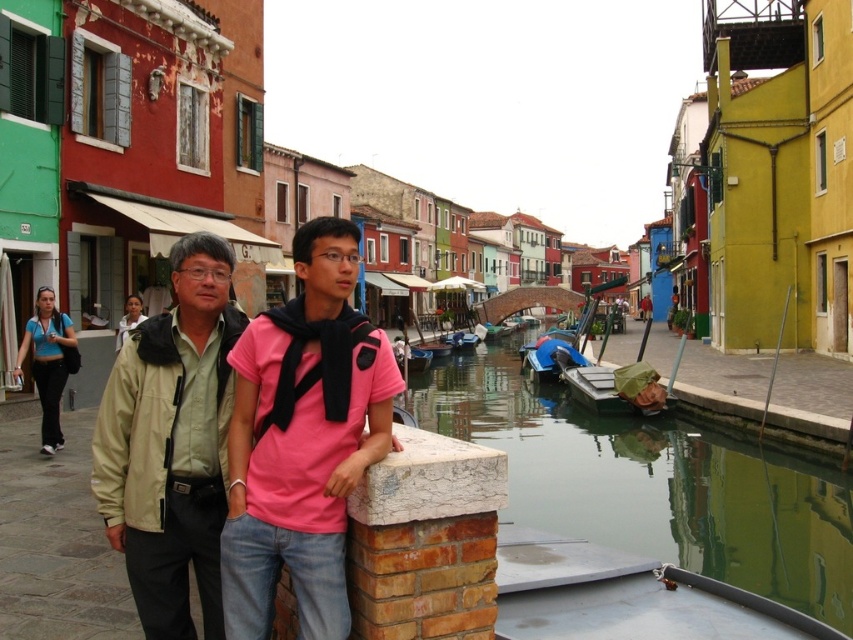
Can you confirm if metallic silver boat at lower right is smaller than blue athletic wear at left?

Yes, metallic silver boat at lower right is smaller than blue athletic wear at left.

Between metallic silver boat at lower right and blue athletic wear at left, which one has more height?

blue athletic wear at left

Is point (547, 556) closer to viewer compared to point (41, 380)?

Yes, it is in front of point (41, 380).

I want to click on metallic silver boat at lower right, so click(625, 596).

Can you confirm if green reflective water at lower center is positioned above beige fabric jacket at center?

Actually, green reflective water at lower center is below beige fabric jacket at center.

Does green reflective water at lower center appear on the right side of beige fabric jacket at center?

Yes, green reflective water at lower center is to the right of beige fabric jacket at center.

Who is more forward, (741,506) or (178,308)?

Point (178,308) is in front.

The width and height of the screenshot is (853, 640). What are the coordinates of `green reflective water at lower center` in the screenshot? It's located at (653, 483).

Which is more to the right, green reflective water at lower center or metallic silver boat at lower right?

Positioned to the right is metallic silver boat at lower right.

Who is taller, green reflective water at lower center or metallic silver boat at lower right?

green reflective water at lower center

Who is more forward, [548,490] or [540,570]?

Point [540,570]

Image resolution: width=853 pixels, height=640 pixels. Find the location of `green reflective water at lower center`. green reflective water at lower center is located at coordinates (653, 483).